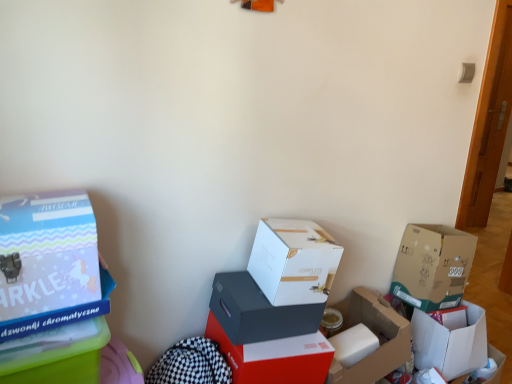
Question: Is white cardboard box at lower right, the 1th box in the right-to-left sequence, taller or shorter than matte black box at center, placed as the fourth box when sorted from left to right?

Choices:
 (A) tall
 (B) short

Answer: (A)

Question: Does point (425, 354) appear closer or farther from the camera than point (229, 317)?

Choices:
 (A) closer
 (B) farther

Answer: (B)

Question: Which object is positioned closest to the matte black box at center, which is the 5th box in right-to-left order?

Choices:
 (A) cardboard box at right, which ranks as the 2th box in right-to-left order
 (B) cardboard box at lower right, the 3th box viewed from the right
 (C) white cardboard box at lower right, which is counted as the eighth box, starting from the left
 (D) pastel blue cardboard box at left, which ranks as the 7th box in right-to-left order
 (E) matte red box at center, which ranks as the third box in left-to-right order

Answer: (E)

Question: Considering the real-world distances, which object is farthest from the matte blue box at left, which appears as the 1th box when viewed from the left?

Choices:
 (A) matte black box at center, placed as the fourth box when sorted from left to right
 (B) matte red box at center, which ranks as the third box in left-to-right order
 (C) white matte box at center, the fourth box from the right
 (D) cardboard box at right, which ranks as the 2th box in right-to-left order
 (E) pastel blue cardboard box at left, the second box in the left-to-right sequence

Answer: (D)